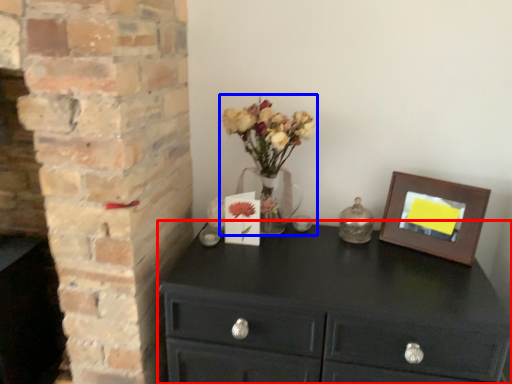
Question: Which of the following is the farthest to the observer, chest of drawers (highlighted by a red box) or floral arrangement (highlighted by a blue box)?

Choices:
 (A) chest of drawers
 (B) floral arrangement

Answer: (B)